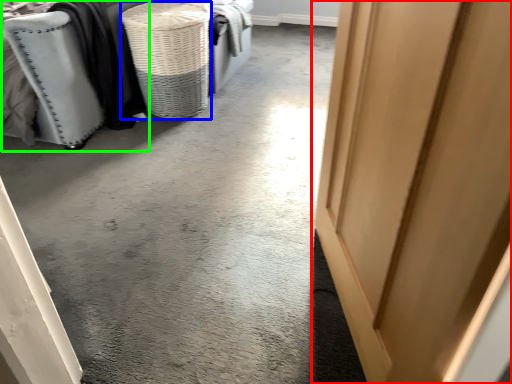
Question: Based on their relative distances, which object is nearer to door (highlighted by a red box)? Choose from basket (highlighted by a blue box) and furniture (highlighted by a green box).

Choices:
 (A) basket
 (B) furniture

Answer: (A)